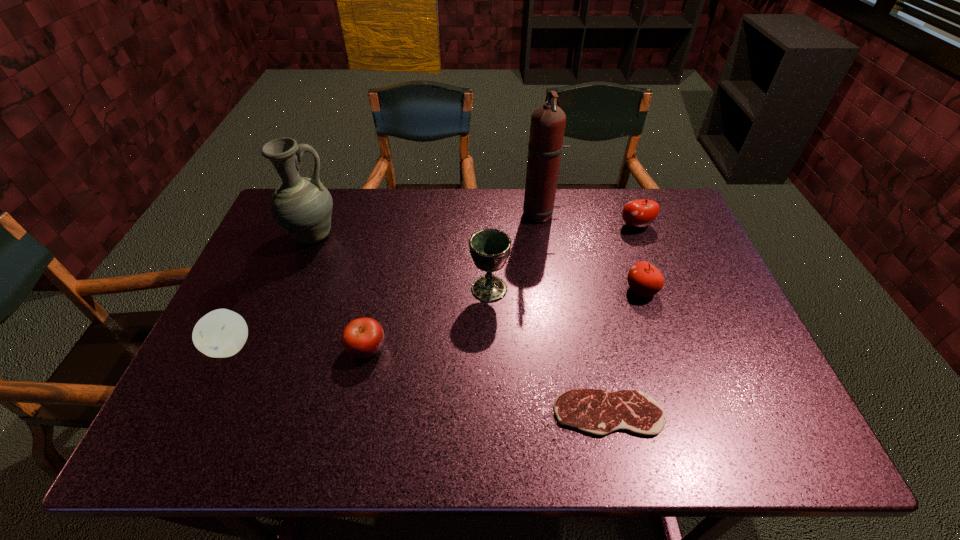
Find the location of a particular element. The width and height of the screenshot is (960, 540). fire extinguisher that is at the far edge is located at coordinates (548, 121).

What are the coordinates of `pitcher at the far edge` in the screenshot? It's located at (302, 206).

At what (x,y) coordinates should I click in order to perform the action: click on apple at the far edge. Please return your answer as a coordinate pair (x, y). Looking at the image, I should click on (639, 213).

This screenshot has width=960, height=540. Find the location of `object at the near edge`. object at the near edge is located at coordinates (597, 412).

Identify the location of pitcher located at the left edge. (302, 206).

Locate an element on the screen. This screenshot has width=960, height=540. apple positioned at the left edge is located at coordinates (221, 333).

Where is `object situated at the right edge`? This screenshot has height=540, width=960. object situated at the right edge is located at coordinates (639, 213).

Where is `object at the far left corner`? object at the far left corner is located at coordinates (302, 206).

Image resolution: width=960 pixels, height=540 pixels. Find the location of `object located in the far right corner section of the desktop`. object located in the far right corner section of the desktop is located at coordinates (639, 213).

Find the location of a particular element. This screenshot has width=960, height=540. vacant point at the far edge is located at coordinates click(517, 191).